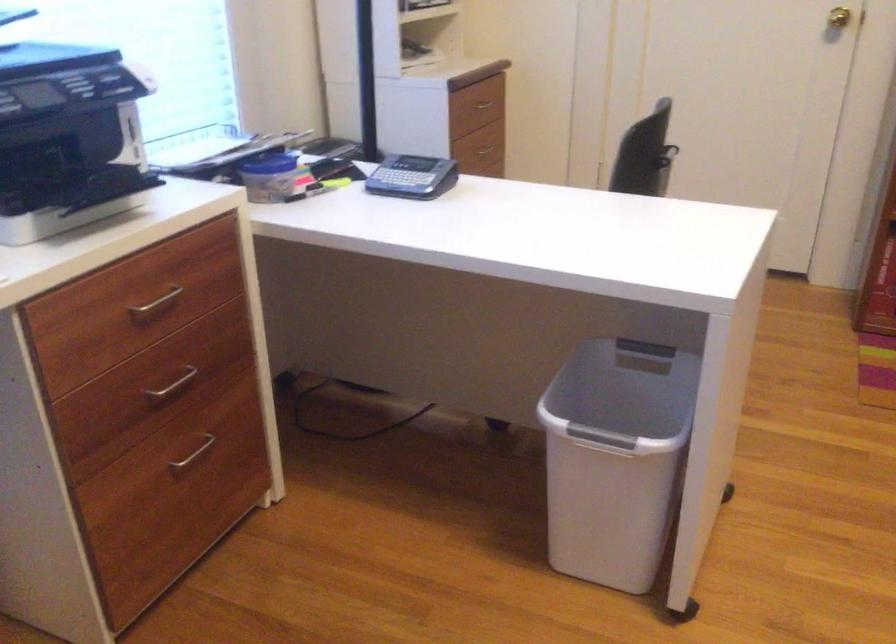
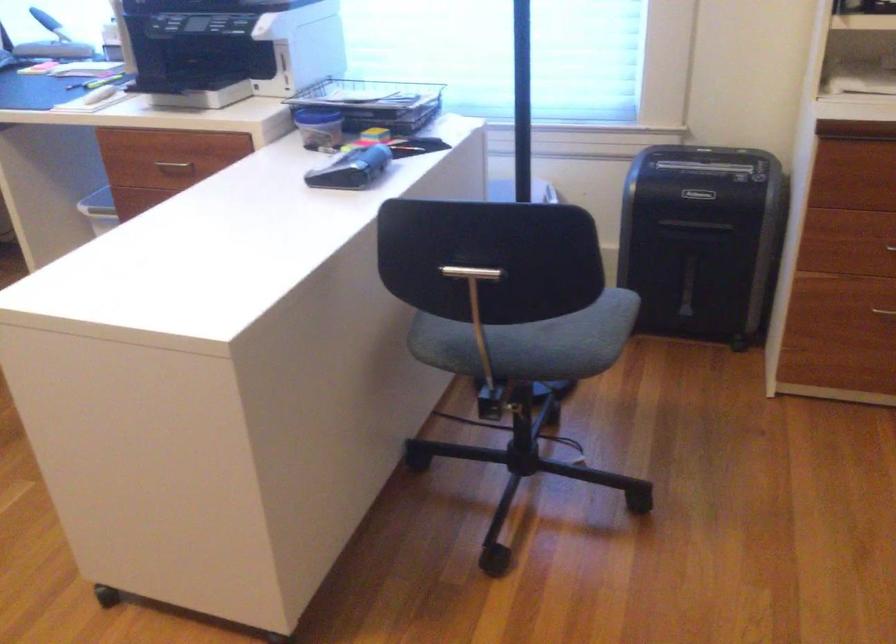
Question: I am providing you with two images of the same scene from different viewpoints. Please identify which objects are invisible in image2.

Choices:
 (A) metal T-handle
 (B) green toilet paper roll
 (C) metal drawer handle
 (D) wire paper tray

Answer: (C)